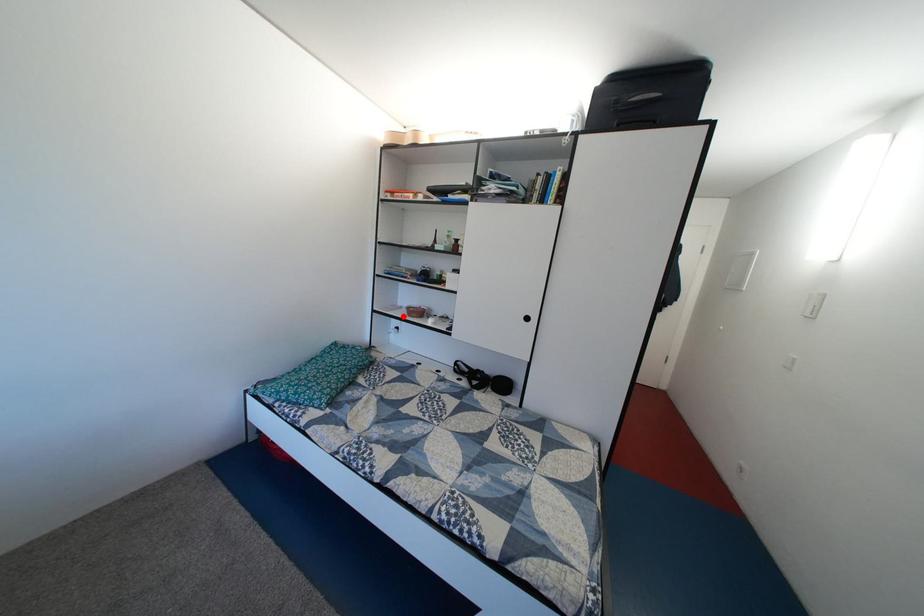
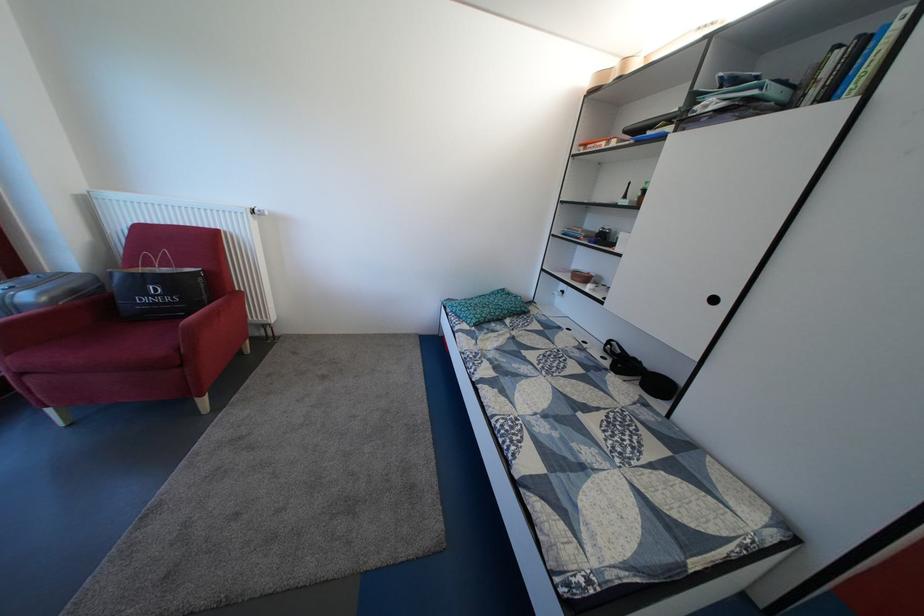
The point at the highlighted location is marked in the first image. Where is the corresponding point in the second image?

(570, 278)